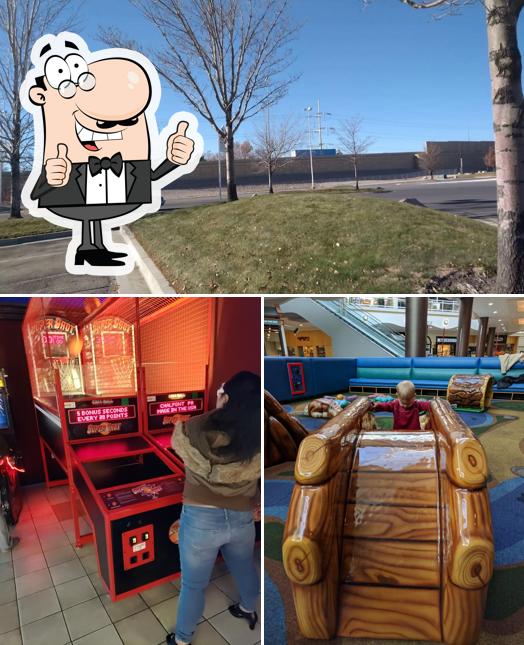
In order to click on tile floor in this screenshot , I will do `click(70, 600)`.